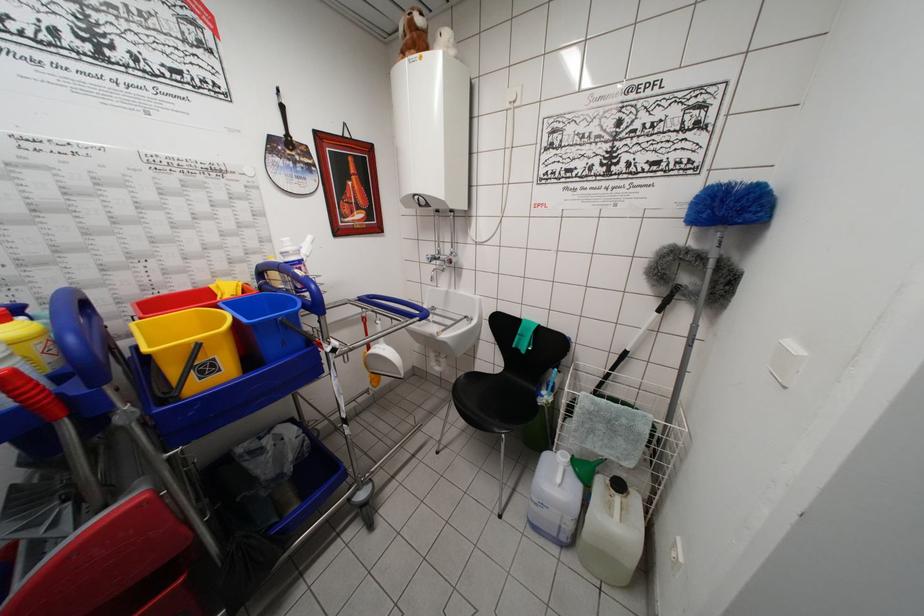
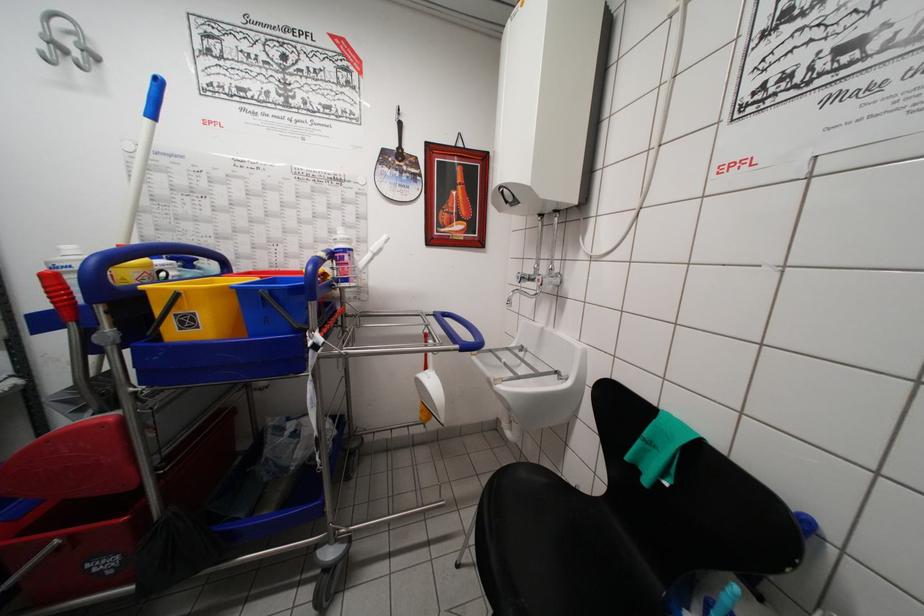
In the second image, find the point that corresponds to pixel 210 260 in the first image.

(319, 252)